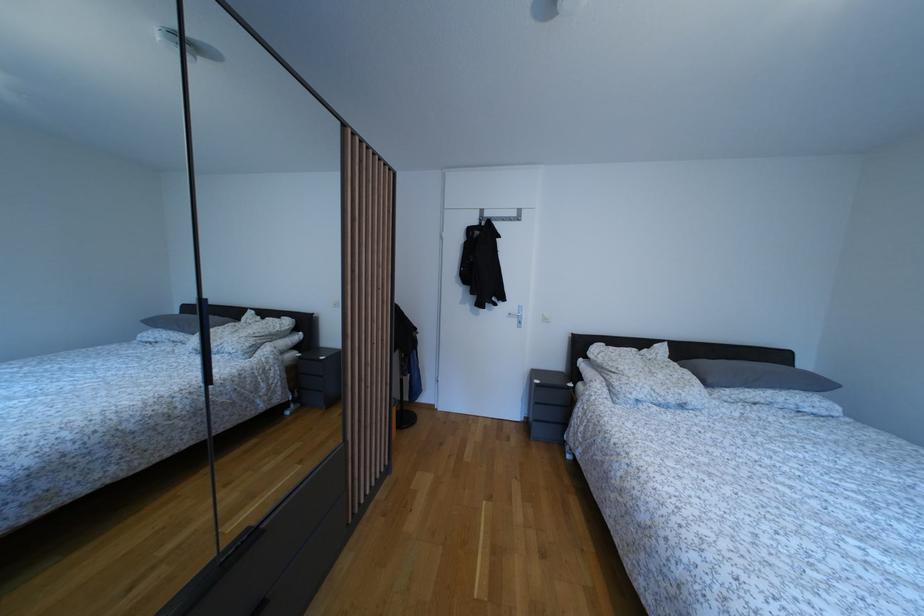
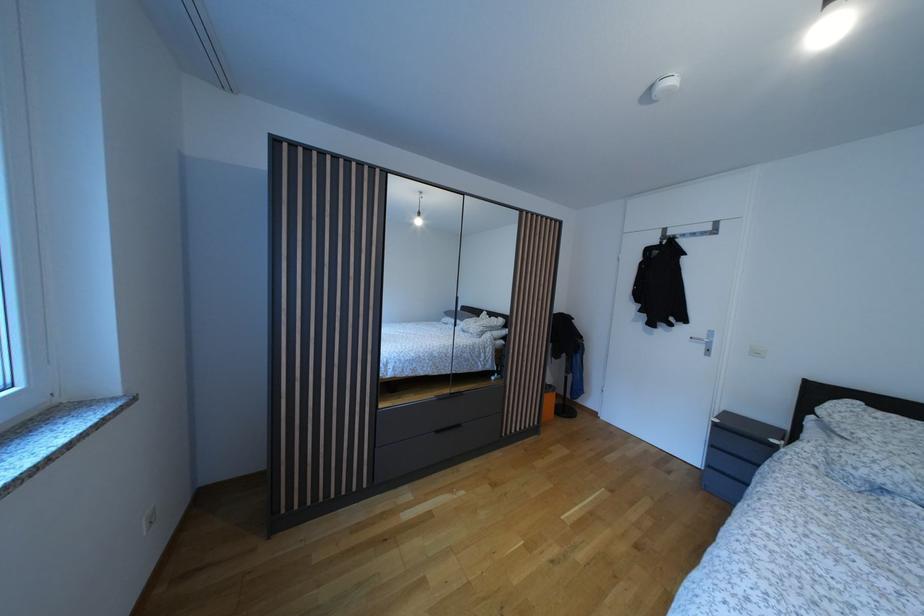
Locate, in the second image, the point that corresponds to (x=543, y=387) in the first image.

(723, 427)